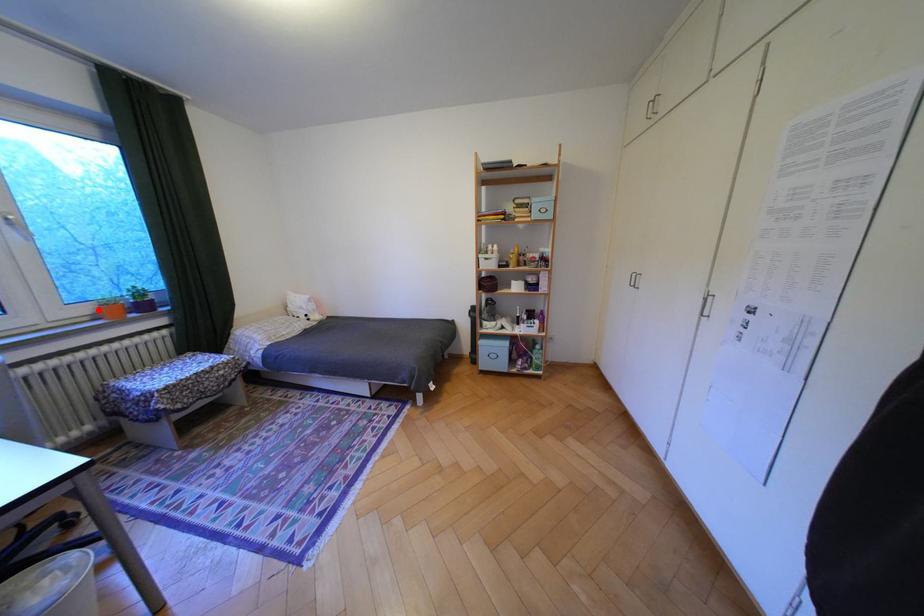
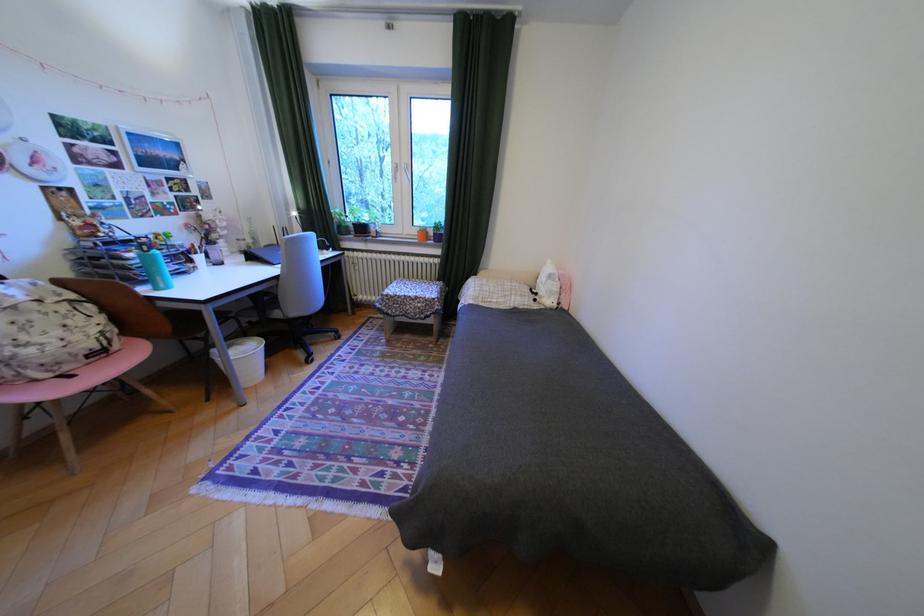
Question: I am providing you with two images of the same scene from different viewpoints. A red point is marked on the first image. Can you still see the location of the red point in image 2?

Choices:
 (A) Yes
 (B) No

Answer: (A)